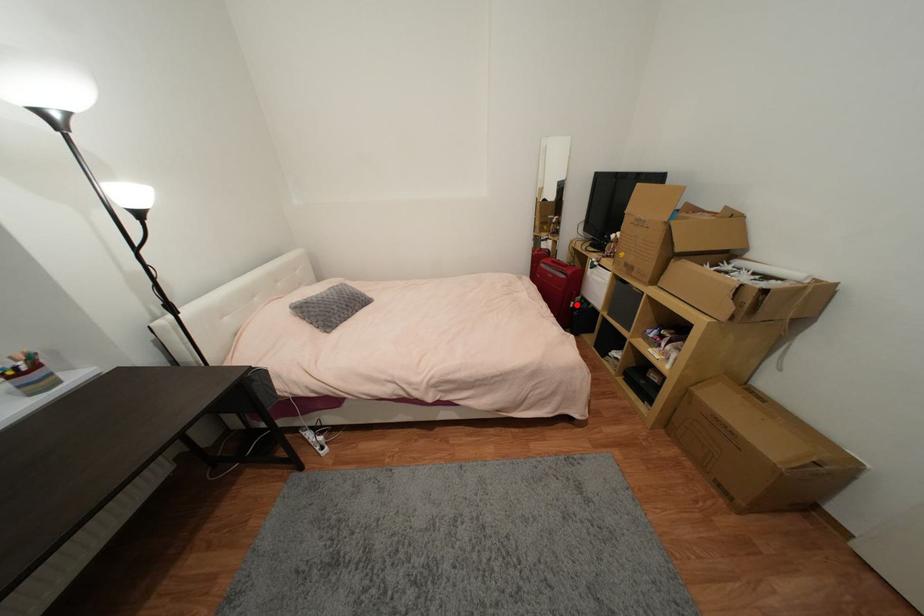
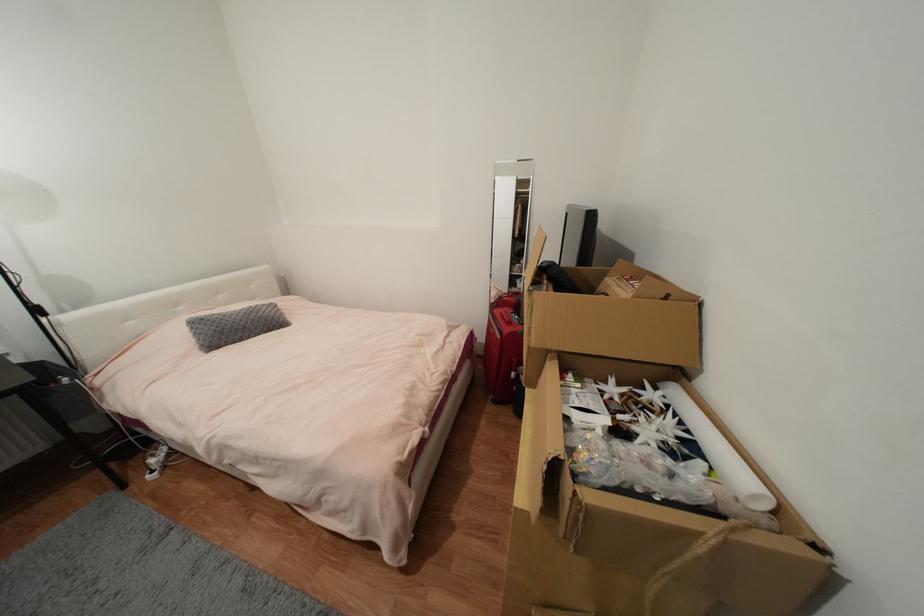
Question: I am providing you with two images of the same scene from different viewpoints. Given a red point in image1, look at the same physical point in image2. Is it:

Choices:
 (A) Closer to the viewpoint
 (B) Farther from the viewpoint

Answer: (A)